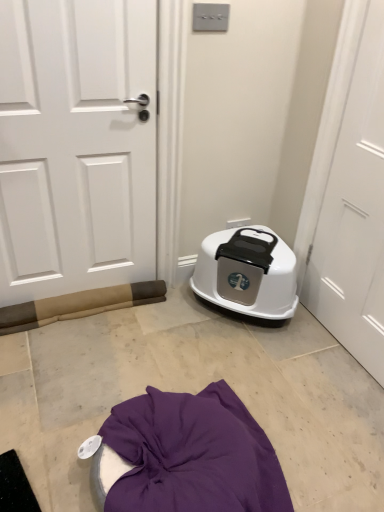
At what (x,y) coordinates should I click in order to perform the action: click on white plastic litter box at center. Please return your answer as a coordinate pair (x, y). This screenshot has height=512, width=384. Looking at the image, I should click on (247, 273).

In terms of width, does white matte door at right, arranged as the second door when viewed from the left, look wider or thinner when compared to white plastic litter box at center?

Clearly, white matte door at right, arranged as the second door when viewed from the left, has less width compared to white plastic litter box at center.

Is white matte door at right, which is counted as the first door, starting from the right, positioned with its back to white plastic litter box at center?

No, white matte door at right, which is counted as the first door, starting from the right, is not facing the opposite direction of white plastic litter box at center.

From a real-world perspective, is white matte door at right, which is counted as the first door, starting from the right, physically above white plastic litter box at center?

Indeed, from a real-world perspective, white matte door at right, which is counted as the first door, starting from the right, stands above white plastic litter box at center.

Considering the points (39, 200) and (372, 150), which point is behind, point (39, 200) or point (372, 150)?

Point (39, 200)

From a real-world perspective, relative to white matte door at right, which is counted as the first door, starting from the right, is white matte door at left, the first door positioned from the left, vertically above or below?

In terms of real-world spatial position, white matte door at left, the first door positioned from the left, is below white matte door at right, which is counted as the first door, starting from the right.

In the scene shown: Is white matte door at right, arranged as the second door when viewed from the left, surrounded by white matte door at left, the first door positioned from the left?

No, white matte door at left, the first door positioned from the left, does not contain white matte door at right, arranged as the second door when viewed from the left.

In the scene shown: From the image's perspective, which is above, white matte door at right, arranged as the second door when viewed from the left, or white matte door at left, the first door positioned from the left?

white matte door at left, the first door positioned from the left.

Which is in front, point (355, 189) or point (154, 156)?

The point (355, 189) is closer.

From a real-world perspective, relative to white matte door at left, acting as the second door starting from the right, is white matte door at right, arranged as the second door when viewed from the left, vertically above or below?

Clearly, from a real-world perspective, white matte door at right, arranged as the second door when viewed from the left, is above white matte door at left, acting as the second door starting from the right.

Is white matte door at right, which is counted as the first door, starting from the right, thinner than white matte door at left, the first door positioned from the left?

Yes.

From a real-world perspective, is white matte door at left, acting as the second door starting from the right, positioned above or below white plastic litter box at center?

white matte door at left, acting as the second door starting from the right, is above white plastic litter box at center.

At what (x,y) coordinates should I click in order to perform the action: click on appliance lying behind the white matte door at left, acting as the second door starting from the right. Please return your answer as a coordinate pair (x, y). This screenshot has height=512, width=384. Looking at the image, I should click on (247, 273).

Considering the relative sizes of white matte door at left, the first door positioned from the left, and white plastic litter box at center in the image provided, is white matte door at left, the first door positioned from the left, wider than white plastic litter box at center?

No, white matte door at left, the first door positioned from the left, is not wider than white plastic litter box at center.

Is white matte door at left, the first door positioned from the left, bigger than white plastic litter box at center?

No.

Does white plastic litter box at center have a lesser height compared to white matte door at left, acting as the second door starting from the right?

Correct, white plastic litter box at center is not as tall as white matte door at left, acting as the second door starting from the right.

Can you see white plastic litter box at center touching white matte door at left, the first door positioned from the left?

No, white plastic litter box at center is not with white matte door at left, the first door positioned from the left.

Considering the points (273, 259) and (143, 102), which point is behind, point (273, 259) or point (143, 102)?

Positioned behind is point (273, 259).

Is white plastic litter box at center oriented towards white matte door at left, the first door positioned from the left?

No, white plastic litter box at center is not turned towards white matte door at left, the first door positioned from the left.

From the image's perspective, is white plastic litter box at center below white matte door at right, arranged as the second door when viewed from the left?

Yes.

From a real-world perspective, is white plastic litter box at center physically below white matte door at right, which is counted as the first door, starting from the right?

Yes, from a real-world perspective, white plastic litter box at center is beneath white matte door at right, which is counted as the first door, starting from the right.

Is white plastic litter box at center in contact with white matte door at right, which is counted as the first door, starting from the right?

No, white plastic litter box at center is not touching white matte door at right, which is counted as the first door, starting from the right.

Where is `door on the right of white plastic litter box at center`? Image resolution: width=384 pixels, height=512 pixels. door on the right of white plastic litter box at center is located at coordinates (355, 214).

The width and height of the screenshot is (384, 512). I want to click on appliance located on the left of white matte door at right, arranged as the second door when viewed from the left, so click(247, 273).

The height and width of the screenshot is (512, 384). Find the location of `door lying above the white matte door at right, arranged as the second door when viewed from the left (from the image's perspective)`. door lying above the white matte door at right, arranged as the second door when viewed from the left (from the image's perspective) is located at coordinates (76, 146).

From the image, which object appears to be nearer to white matte door at left, acting as the second door starting from the right, white plastic litter box at center or white matte door at right, which is counted as the first door, starting from the right?

Based on the image, white plastic litter box at center appears to be nearer to white matte door at left, acting as the second door starting from the right.

Consider the image. Based on their spatial positions, is white matte door at left, the first door positioned from the left, or white matte door at right, which is counted as the first door, starting from the right, closer to white plastic litter box at center?

The object closer to white plastic litter box at center is white matte door at right, which is counted as the first door, starting from the right.

From the image, which object appears to be farther from white matte door at right, arranged as the second door when viewed from the left, white plastic litter box at center or white matte door at left, the first door positioned from the left?

The object further to white matte door at right, arranged as the second door when viewed from the left, is white matte door at left, the first door positioned from the left.

Based on their spatial positions, is white matte door at right, which is counted as the first door, starting from the right, or white matte door at left, the first door positioned from the left, further from white plastic litter box at center?

Among the two, white matte door at left, the first door positioned from the left, is located further to white plastic litter box at center.

Which object lies further to the anchor point white matte door at left, the first door positioned from the left, white matte door at right, which is counted as the first door, starting from the right, or white plastic litter box at center?

white matte door at right, which is counted as the first door, starting from the right, lies further to white matte door at left, the first door positioned from the left, than the other object.

Based on their spatial positions, is white matte door at left, the first door positioned from the left, or white plastic litter box at center further from white matte door at right, arranged as the second door when viewed from the left?

Based on the image, white matte door at left, the first door positioned from the left, appears to be further to white matte door at right, arranged as the second door when viewed from the left.

Image resolution: width=384 pixels, height=512 pixels. I want to click on appliance between white matte door at left, acting as the second door starting from the right, and white matte door at right, arranged as the second door when viewed from the left, so click(x=247, y=273).